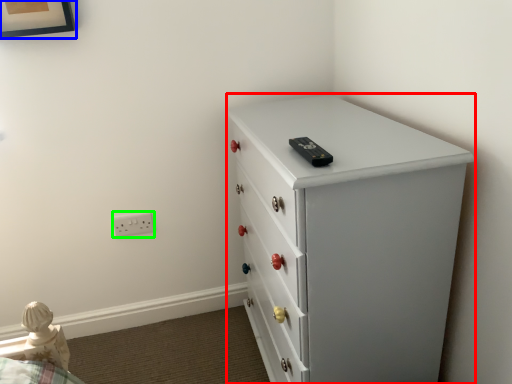
Question: Which object is the farthest from chest of drawers (highlighted by a red box)? Choose among these: picture frame (highlighted by a blue box) or electric outlet (highlighted by a green box).

Choices:
 (A) picture frame
 (B) electric outlet

Answer: (A)